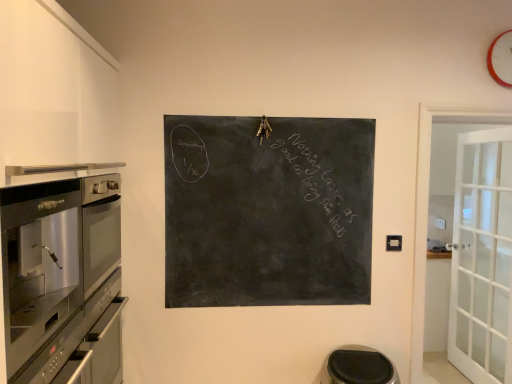
Question: In terms of width, does black chalkboard at center look wider or thinner when compared to stainless steel oven at left?

Choices:
 (A) wide
 (B) thin

Answer: (B)

Question: From the image's perspective, relative to stainless steel oven at left, is black chalkboard at center above or below?

Choices:
 (A) above
 (B) below

Answer: (A)

Question: Considering the real-world distances, which object is farthest from the orange plastic clock at upper right?

Choices:
 (A) stainless steel oven at left
 (B) black rubber step stool at lower center
 (C) black chalkboard at center

Answer: (A)

Question: Considering the real-world distances, which object is farthest from the orange plastic clock at upper right?

Choices:
 (A) stainless steel oven at left
 (B) black chalkboard at center
 (C) black rubber step stool at lower center

Answer: (A)